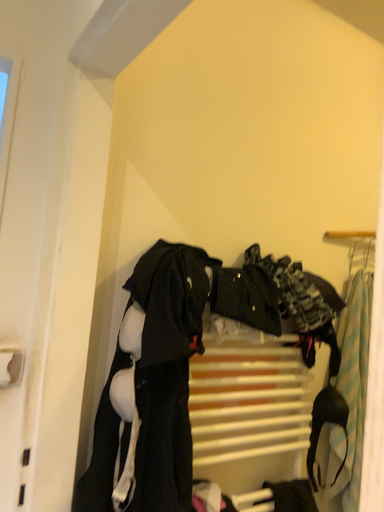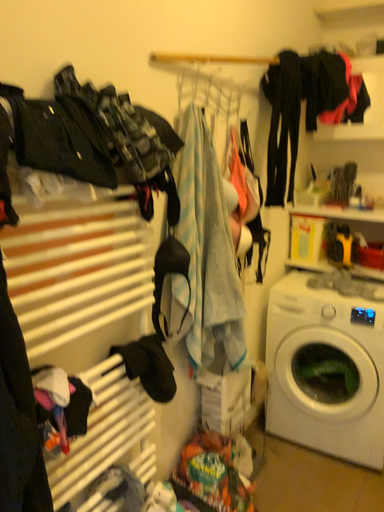
Question: How did the camera likely rotate when shooting the video?

Choices:
 (A) rotated downward
 (B) rotated upward

Answer: (A)